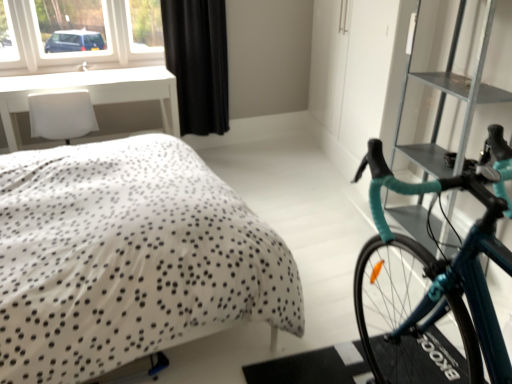
Question: Is white plastic window at upper left inside the boundaries of teal glossy bicycle at right, or outside?

Choices:
 (A) outside
 (B) inside

Answer: (A)

Question: From a real-world perspective, is white plastic window at upper left physically located above or below teal glossy bicycle at right?

Choices:
 (A) below
 (B) above

Answer: (B)

Question: Estimate the real-world distances between objects in this image. Which object is farther from the black textured curtain at upper center?

Choices:
 (A) white dotted fabric bed at center
 (B) white glossy table at upper left
 (C) teal glossy bicycle at right
 (D) metallic gray bookshelf at right
 (E) white plastic window at upper left

Answer: (C)

Question: Which object is the closest to the white plastic window at upper left?

Choices:
 (A) white glossy table at upper left
 (B) white dotted fabric bed at center
 (C) metallic gray bookshelf at right
 (D) black textured curtain at upper center
 (E) teal glossy bicycle at right

Answer: (A)